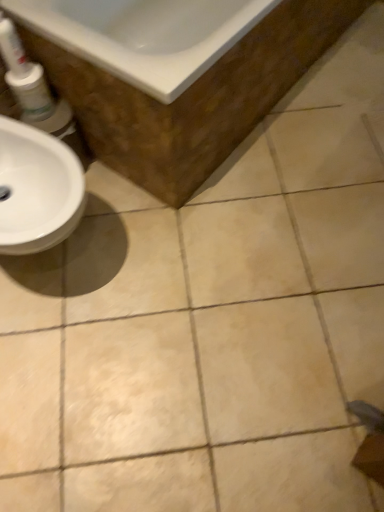
Question: Is white glossy tube at upper left looking in the opposite direction of white glossy mouthwash at left?

Choices:
 (A) no
 (B) yes

Answer: (A)

Question: Is white glossy tube at upper left thinner than white glossy mouthwash at left?

Choices:
 (A) yes
 (B) no

Answer: (A)

Question: From the image's perspective, is white glossy tube at upper left below white glossy mouthwash at left?

Choices:
 (A) yes
 (B) no

Answer: (B)

Question: Is white glossy tube at upper left to the left of white glossy mouthwash at left from the viewer's perspective?

Choices:
 (A) no
 (B) yes

Answer: (B)

Question: Does white glossy tube at upper left contain white glossy mouthwash at left?

Choices:
 (A) yes
 (B) no

Answer: (B)

Question: From a real-world perspective, relative to white glossy bathtub at upper left, is white glossy tube at upper left vertically above or below?

Choices:
 (A) below
 (B) above

Answer: (B)

Question: Is white glossy tube at upper left spatially inside white glossy bathtub at upper left, or outside of it?

Choices:
 (A) inside
 (B) outside

Answer: (B)

Question: From the image's perspective, is white glossy tube at upper left positioned above or below white glossy bathtub at upper left?

Choices:
 (A) above
 (B) below

Answer: (B)

Question: In the image, is white glossy tube at upper left positioned in front of or behind white glossy bathtub at upper left?

Choices:
 (A) behind
 (B) front

Answer: (A)

Question: From a real-world perspective, is white glossy mouthwash at left physically located above or below white glossy tube at upper left?

Choices:
 (A) below
 (B) above

Answer: (A)

Question: From the image's perspective, relative to white glossy tube at upper left, is white glossy mouthwash at left above or below?

Choices:
 (A) below
 (B) above

Answer: (A)

Question: Considering the positions of point (21, 86) and point (8, 22), is point (21, 86) closer or farther from the camera than point (8, 22)?

Choices:
 (A) closer
 (B) farther

Answer: (B)

Question: Visually, is white glossy mouthwash at left positioned to the left or to the right of white glossy tube at upper left?

Choices:
 (A) right
 (B) left

Answer: (A)

Question: Considering the positions of white glossy tube at upper left and white glossy mouthwash at left in the image, is white glossy tube at upper left bigger or smaller than white glossy mouthwash at left?

Choices:
 (A) big
 (B) small

Answer: (B)

Question: Considering the positions of white glossy tube at upper left and white glossy mouthwash at left in the image, is white glossy tube at upper left taller or shorter than white glossy mouthwash at left?

Choices:
 (A) tall
 (B) short

Answer: (A)